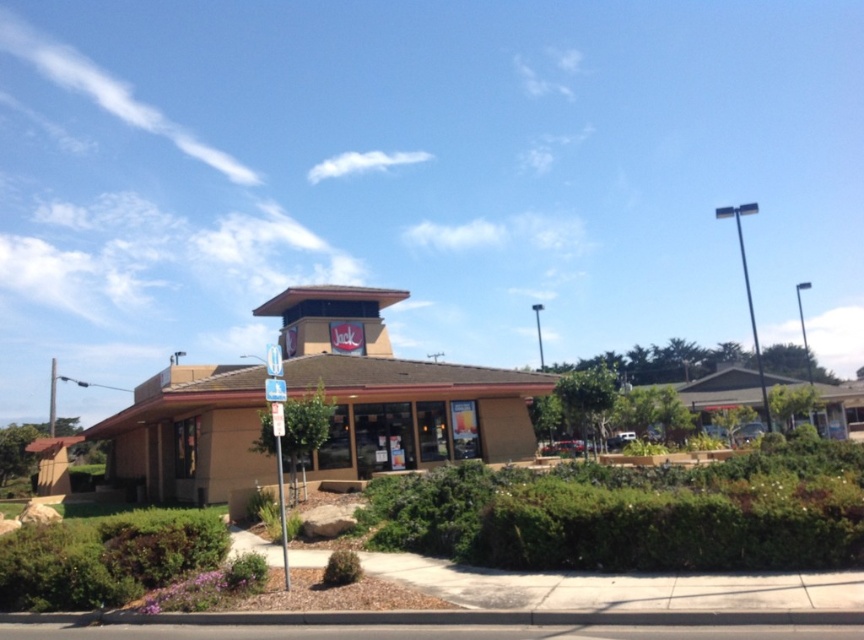
Question: Which object is farther from the camera taking this photo?

Choices:
 (A) green leafy bush at right
 (B) brown wood building at center
 (C) green leafy hedge at lower left
 (D) tan/beige building at center

Answer: (B)

Question: Is tan/beige building at center bigger than green leafy hedge at lower left?

Choices:
 (A) no
 (B) yes

Answer: (B)

Question: Among these objects, which one is farthest from the camera?

Choices:
 (A) tan/beige building at center
 (B) green leafy hedge at lower left
 (C) green leafy hedge at lower center

Answer: (A)

Question: Does tan/beige building at center appear on the left side of green leafy bush at right?

Choices:
 (A) no
 (B) yes

Answer: (B)

Question: Can you confirm if green leafy hedge at lower center is thinner than brown wood building at center?

Choices:
 (A) yes
 (B) no

Answer: (A)

Question: Which point appears farthest from the camera in this image?

Choices:
 (A) (798, 387)
 (B) (729, 538)
 (C) (135, 524)
 (D) (859, 429)

Answer: (A)